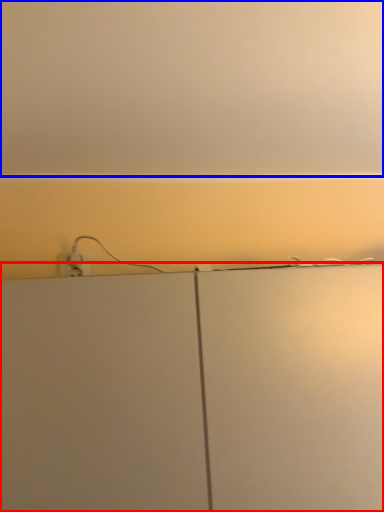
Question: Among these objects, which one is nearest to the camera, cabinetry (highlighted by a red box) or backdrop (highlighted by a blue box)?

Choices:
 (A) cabinetry
 (B) backdrop

Answer: (B)